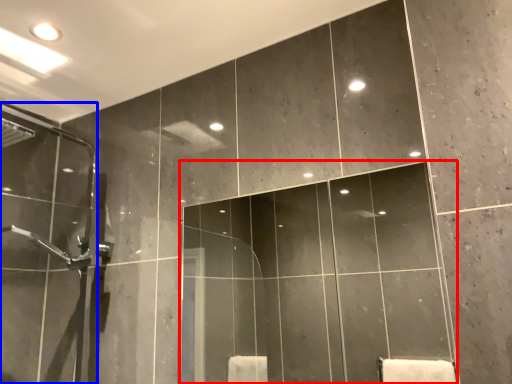
Question: Which object is further to the camera taking this photo, mirror (highlighted by a red box) or screen door (highlighted by a blue box)?

Choices:
 (A) mirror
 (B) screen door

Answer: (B)